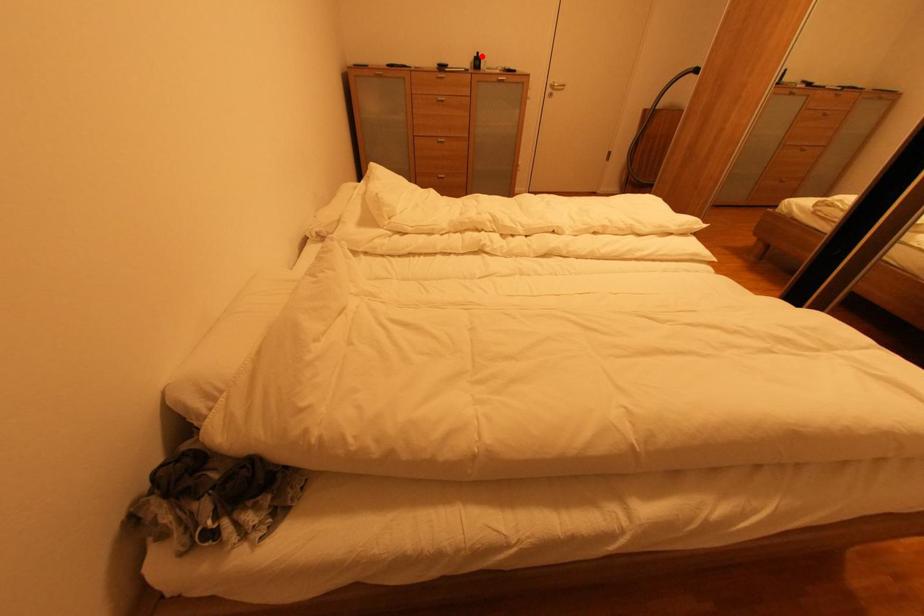
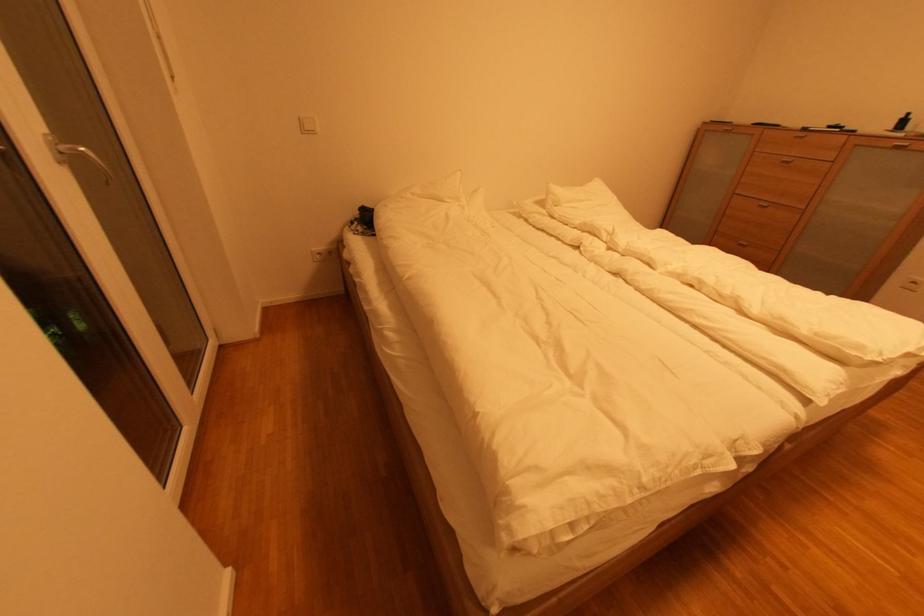
Locate, in the second image, the point that corresponds to the highlighted location in the first image.

(908, 118)